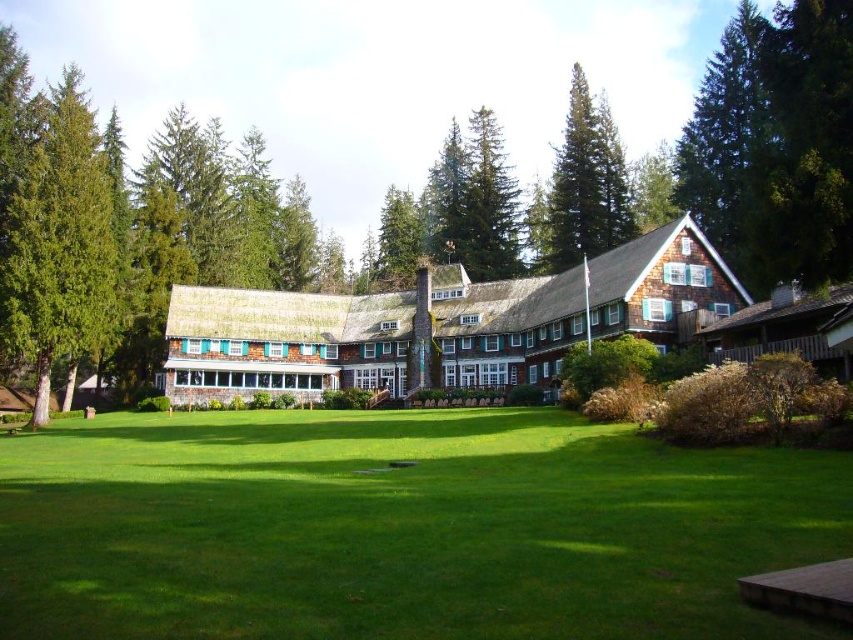
You are standing at the entrance of the rustic lodge and want to locate the brown shingles at center. According to the building structure, where would you find them?

The brown shingles at center are located at point coordinates approximately [438,323] on the building structure.

You are standing on the porch of the rustic building and looking towards the lawn. Which of the two trees, the green textured tree at left or the green shaggy pine at upper center, appears closer to you based on their positions?

The green textured tree at left appears closer because it is positioned above the green shaggy pine at upper center, indicating it is nearer in the visual plane.